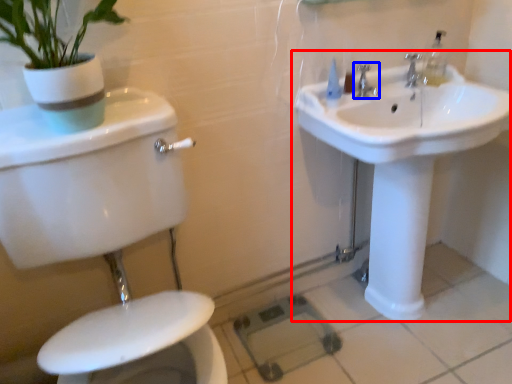
Question: Among these objects, which one is farthest to the camera, sink (highlighted by a red box) or tap (highlighted by a blue box)?

Choices:
 (A) sink
 (B) tap

Answer: (B)